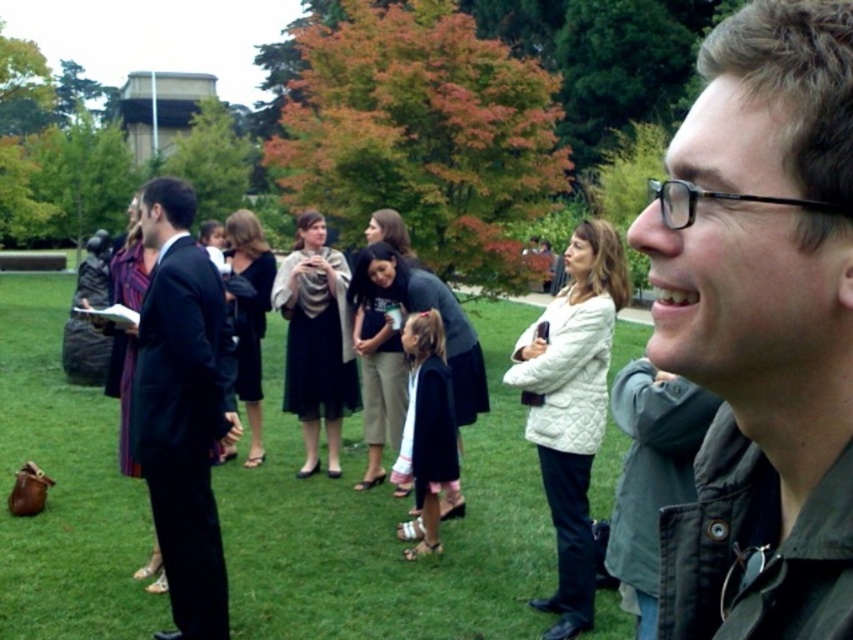
You are standing at the position of the man in the dark jacket on the right side of the image. You want to take a photo of the white quilted jacket at center using a camera that has a minimum focusing distance of 3 meters. Can you take the photo without moving closer?

The white quilted jacket at center and the camera are 4.29 meters apart. Since the minimum focusing distance is 3 meters, the camera can focus on the white quilted jacket at center from that distance. Therefore, you can take the photo without moving closer.

You are a photographer at the event and want to take a photo that includes both the dark gray sweater at center and the black wool dress at center. Which one should you position to the left in your camera frame to maintain their original spatial arrangement?

To maintain their original spatial arrangement, the black wool dress at center should be positioned to the left in your camera frame since the dark gray sweater at center is originally on the right side of the black wool dress at center.

You are a photographer trying to capture a group photo of the people in the scene. You are standing at the edge of the grassy area, facing the group. The two key subjects you want to include are the white quilted jacket at center and the black wool dress at center. Given that your camera has a maximum zoom range that can cover 3 meters, will you be able to fit both subjects into the frame without moving closer?

The white quilted jacket at center and the black wool dress at center are 3.49 meters apart from each other. Since the camera can only cover 3 meters, you will not be able to fit both subjects into the frame without moving closer.